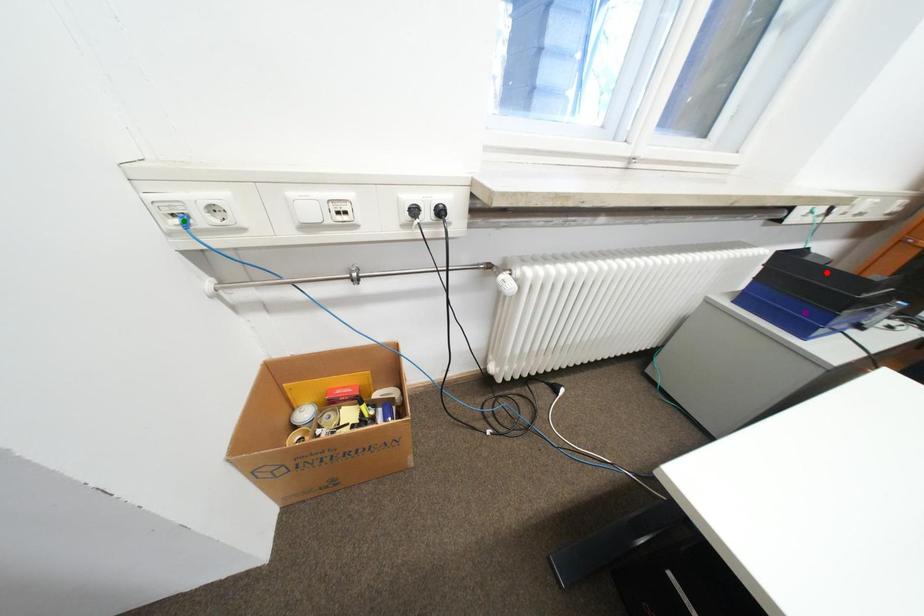
Order these from nearest to farthest:
A) purple point
B) red point
C) green point

red point, purple point, green point